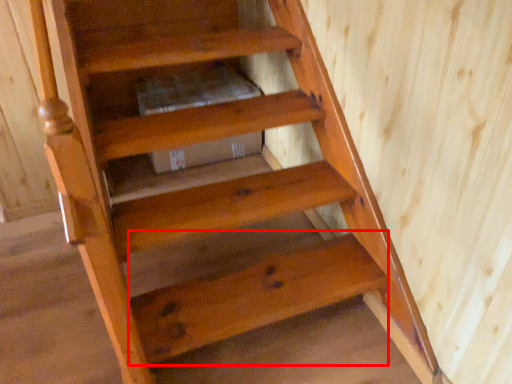
Question: Considering the relative positions of stairwell (annotated by the red box) and stairwell in the image provided, where is stairwell (annotated by the red box) located with respect to the staircase?

Choices:
 (A) left
 (B) right

Answer: (B)